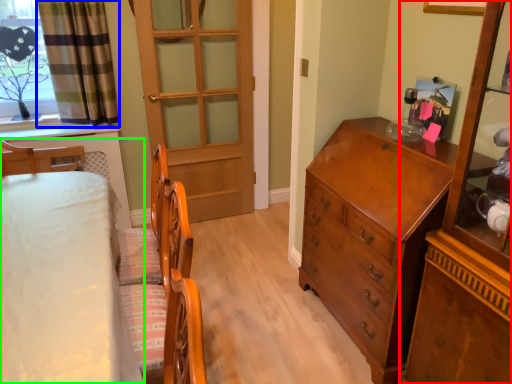
Question: Which object is positioned closest to cabinetry (highlighted by a red box)? Select from curtain (highlighted by a blue box) and bed (highlighted by a green box).

Choices:
 (A) curtain
 (B) bed

Answer: (B)